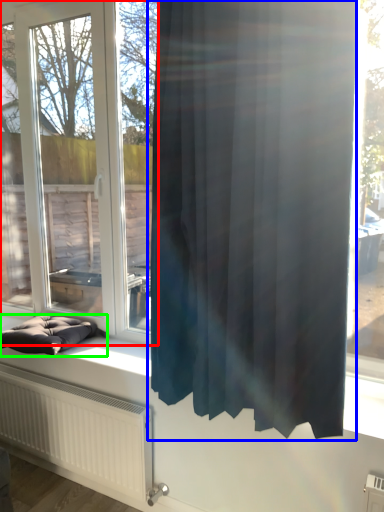
Question: Estimate the real-world distances between objects in this image. Which object is farther from window (highlighted by a red box), curtain (highlighted by a blue box) or furniture (highlighted by a green box)?

Choices:
 (A) curtain
 (B) furniture

Answer: (A)